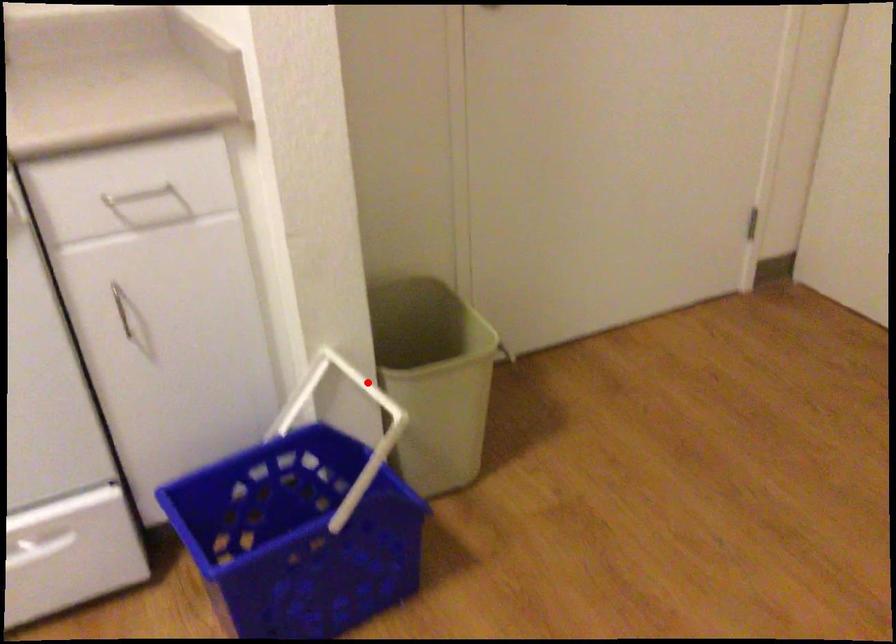
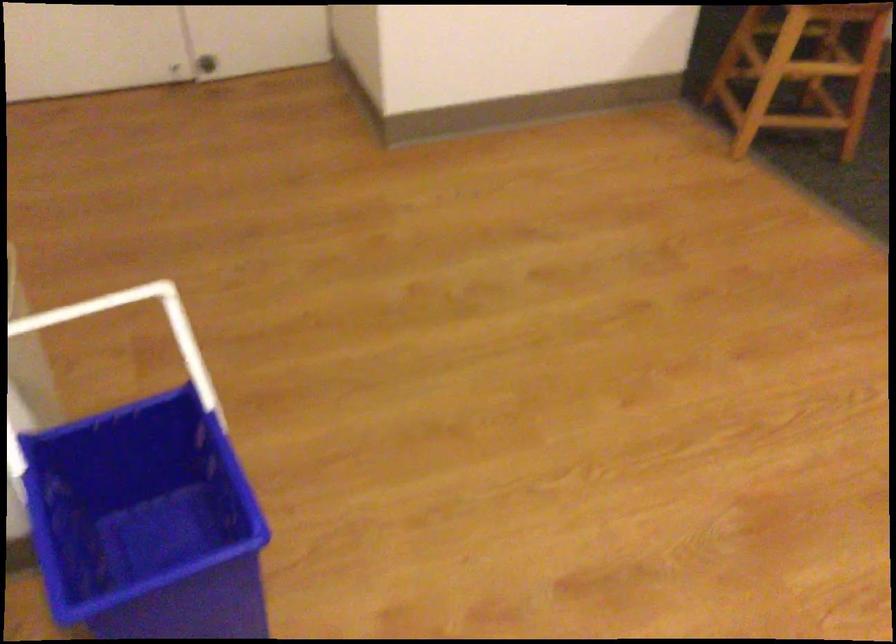
Question: I am providing you with two images of the same scene from different viewpoints. A red point is marked on the first image. Can you still see the location of the red point in image 2?

Choices:
 (A) Yes
 (B) No

Answer: (A)